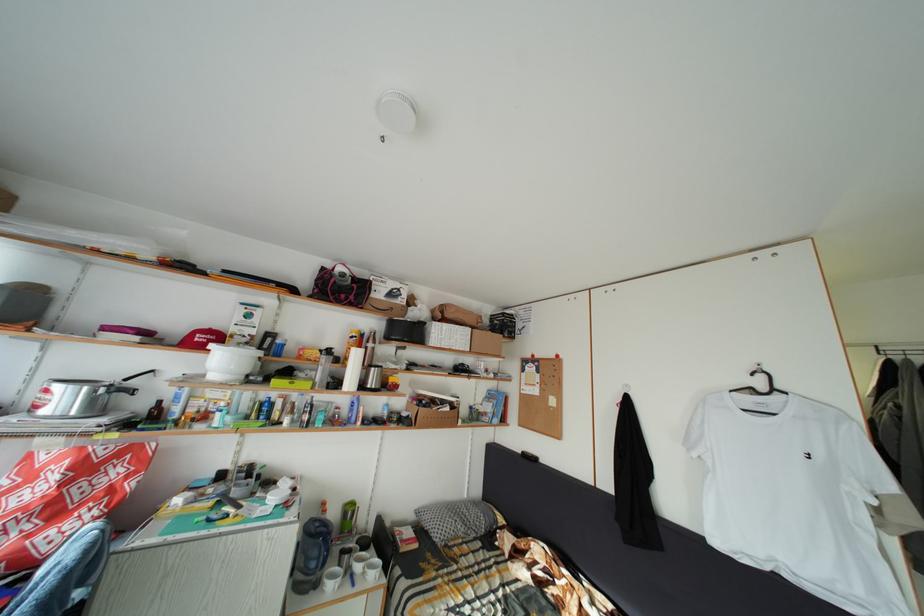
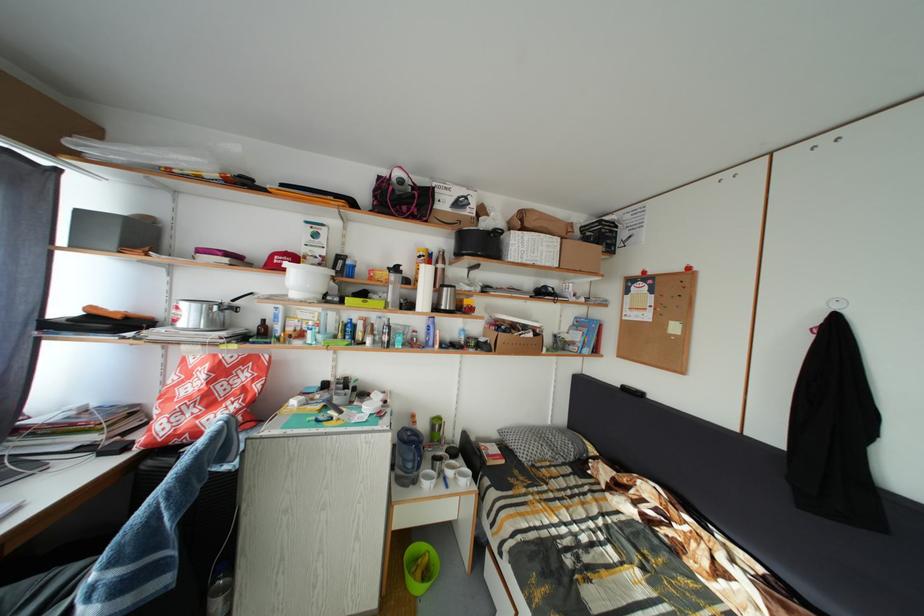
Locate, in the second image, the point that corresponds to point (324, 560) in the first image.

(419, 464)